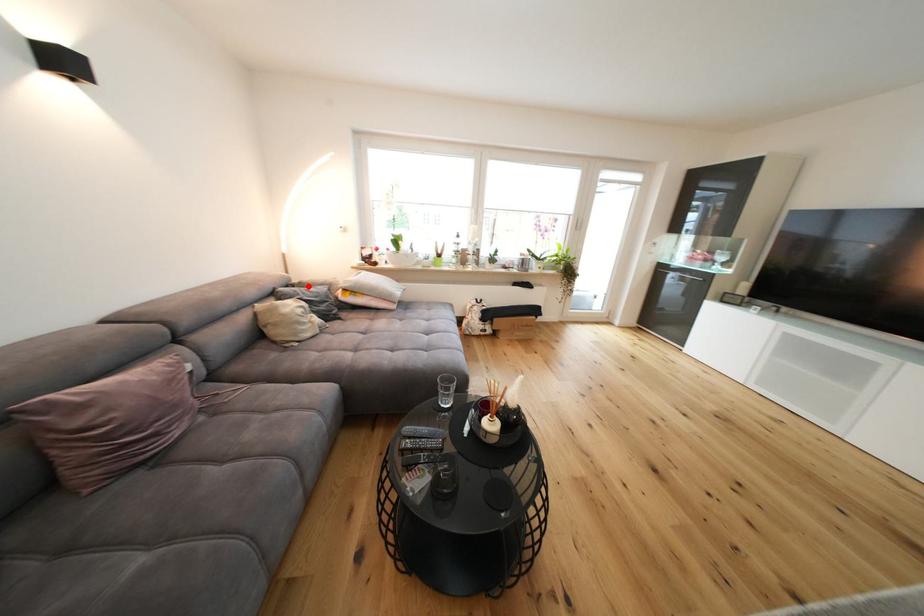
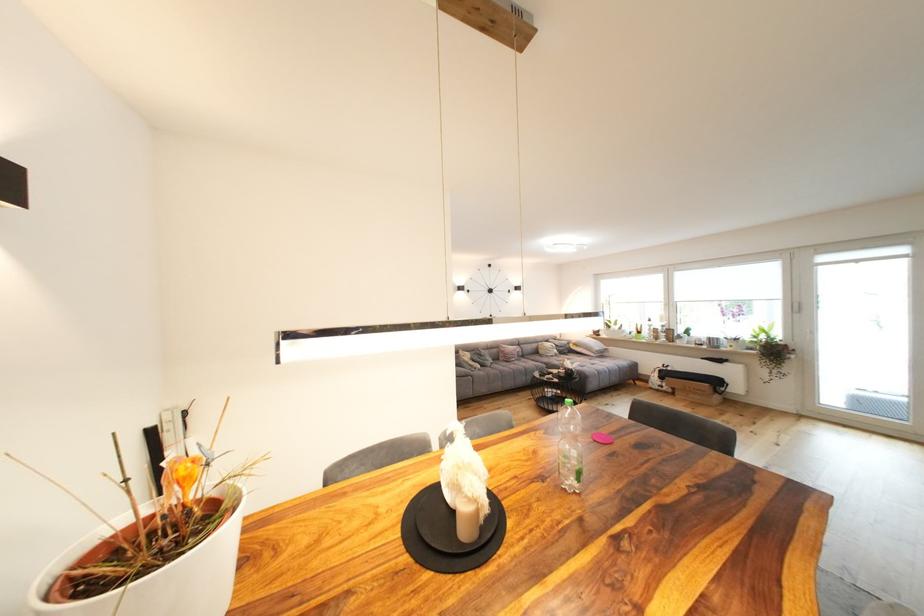
Find the pixel in the second image that matches the highlighted location in the first image.

(566, 342)